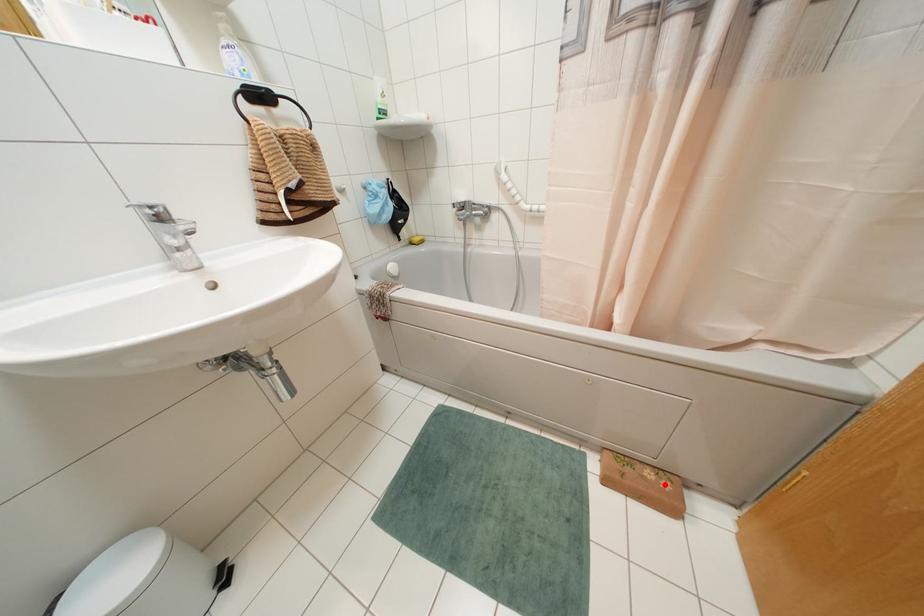
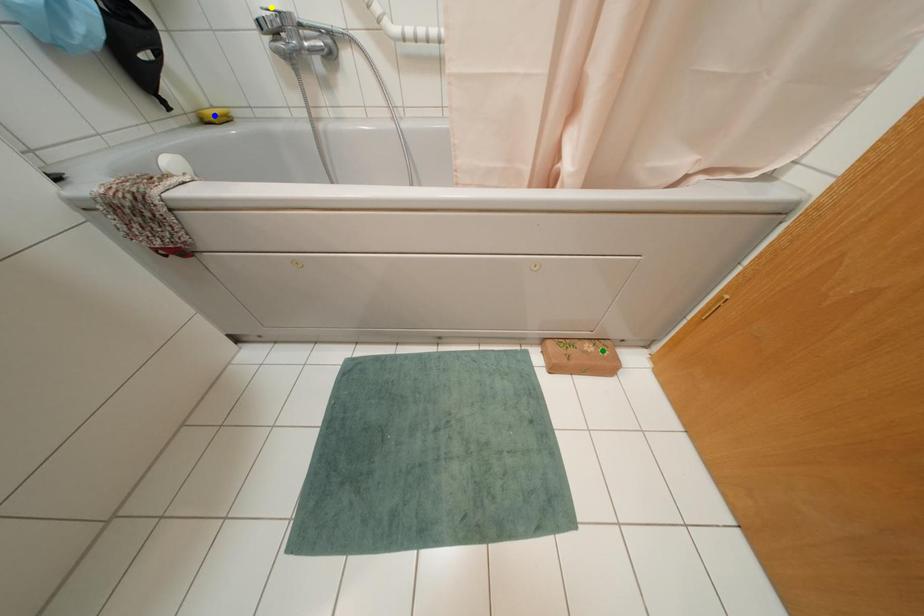
Question: I am providing you with two images of the same scene from different viewpoints. A red point is marked on the first image. You are given multiple points on the second image. Which spot in image 2 lines up with the point in image 1?

Choices:
 (A) yellow point
 (B) blue point
 (C) green point

Answer: (C)